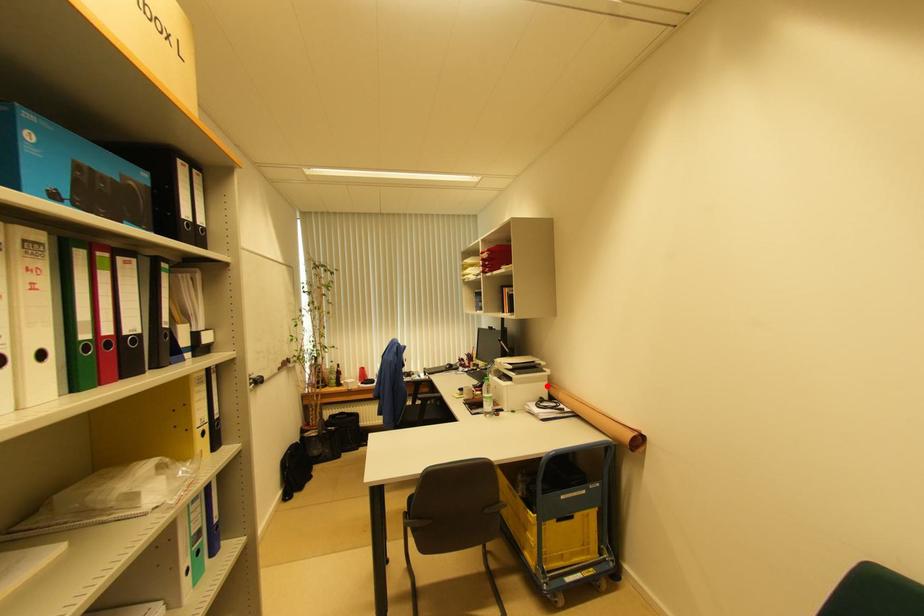
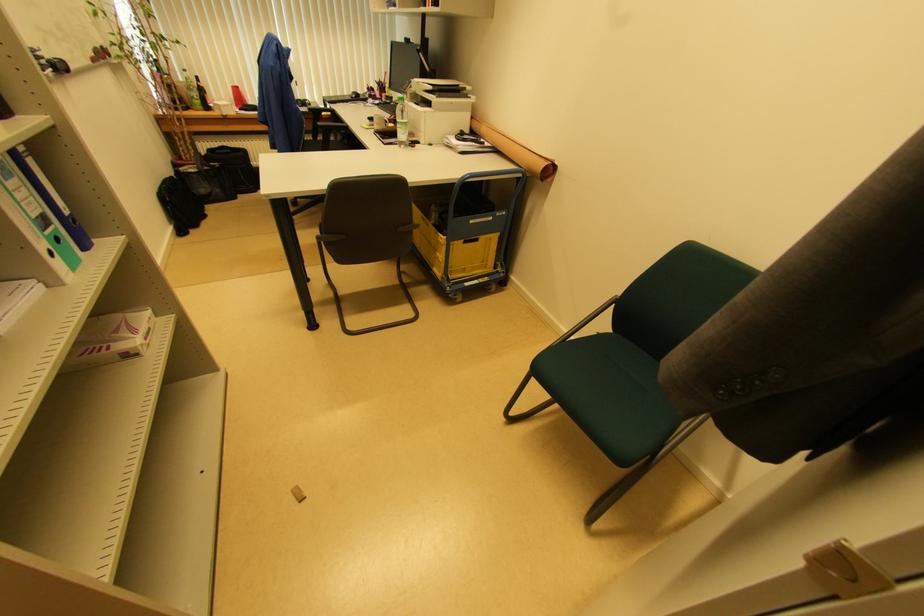
The point at the highlighted location is marked in the first image. Where is the corresponding point in the second image?

(469, 118)